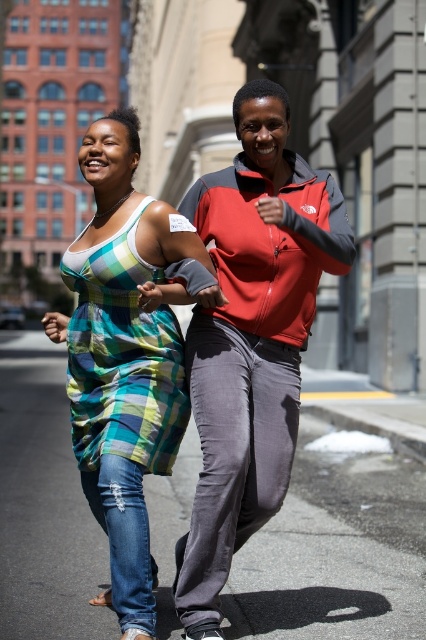
From the picture: Between gray asphalt at center and plaid fabric dress at center, which one appears on the right side from the viewer's perspective?

Positioned to the right is plaid fabric dress at center.

Based on the photo, which is more to the left, gray asphalt at center or plaid fabric dress at center?

Positioned to the left is gray asphalt at center.

The image size is (426, 640). In order to click on gray asphalt at center in this screenshot , I will do [x=328, y=566].

The height and width of the screenshot is (640, 426). What do you see at coordinates (250, 337) in the screenshot?
I see `plaid fabric dress at center` at bounding box center [250, 337].

Looking at this image, is plaid fabric dress at center positioned in front of plaid cotton dress at left?

Yes, plaid fabric dress at center is closer to the viewer.

What do you see at coordinates (250, 337) in the screenshot? I see `plaid fabric dress at center` at bounding box center [250, 337].

This screenshot has width=426, height=640. I want to click on plaid fabric dress at center, so click(250, 337).

Which is behind, point (60, 413) or point (104, 410)?

Positioned behind is point (60, 413).

Is gray asphalt at center further to the viewer compared to plaid cotton dress at left?

Yes.

The height and width of the screenshot is (640, 426). What are the coordinates of `gray asphalt at center` in the screenshot? It's located at click(x=328, y=566).